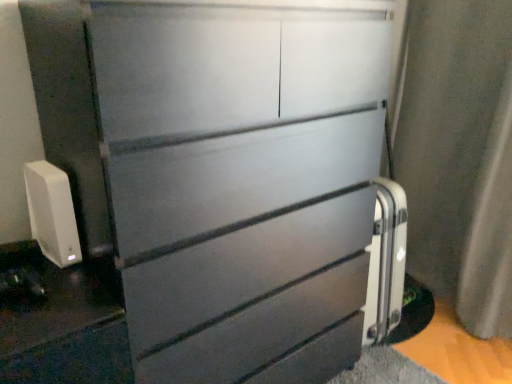
The width and height of the screenshot is (512, 384). What do you see at coordinates (52, 213) in the screenshot? I see `white plastic router at lower left` at bounding box center [52, 213].

In order to face white plastic router at lower left, should I rotate leftwards or rightwards?

To face it directly, rotate left by 25.650 degrees.

Locate an element on the screen. white plastic router at lower left is located at coordinates (52, 213).

This screenshot has width=512, height=384. Find the location of `white plastic router at lower left`. white plastic router at lower left is located at coordinates (52, 213).